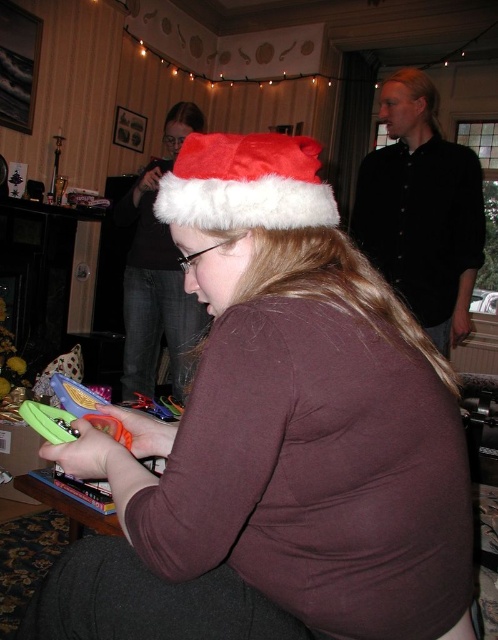
Does matte plastic toy at center have a lesser width compared to fuzzy white santa hat at upper center?

In fact, matte plastic toy at center might be wider than fuzzy white santa hat at upper center.

You are a GUI agent. You are given a task and a screenshot of the screen. Output one action in this format:
    pyautogui.click(x=<x>, y=<y>)
    Task: Click on the matte plastic toy at center
    
    Given the screenshot: What is the action you would take?
    pyautogui.click(x=293, y=416)

You are a GUI agent. You are given a task and a screenshot of the screen. Output one action in this format:
    pyautogui.click(x=<x>, y=<y>)
    Task: Click on the matte plastic toy at center
    This screenshot has width=498, height=640.
    Given the screenshot: What is the action you would take?
    click(x=293, y=416)

Who is more distant from viewer, (244, 170) or (134, 285)?

Positioned behind is point (134, 285).

Does fuzzy white santa hat at center appear on the right side of fuzzy white santa hat at upper center?

Indeed, fuzzy white santa hat at center is positioned on the right side of fuzzy white santa hat at upper center.

You are a GUI agent. You are given a task and a screenshot of the screen. Output one action in this format:
    pyautogui.click(x=<x>, y=<y>)
    Task: Click on the fuzzy white santa hat at center
    This screenshot has width=498, height=640.
    Given the screenshot: What is the action you would take?
    pyautogui.click(x=246, y=182)

Is matte plastic toy at center taller than fuzzy white santa hat at center?

Yes.

Between matte plastic toy at center and fuzzy white santa hat at center, which one is positioned lower?

Positioned lower is matte plastic toy at center.

Does point (402, 426) come behind point (202, 168)?

No.

Identify the location of matte plastic toy at center. This screenshot has height=640, width=498. (293, 416).